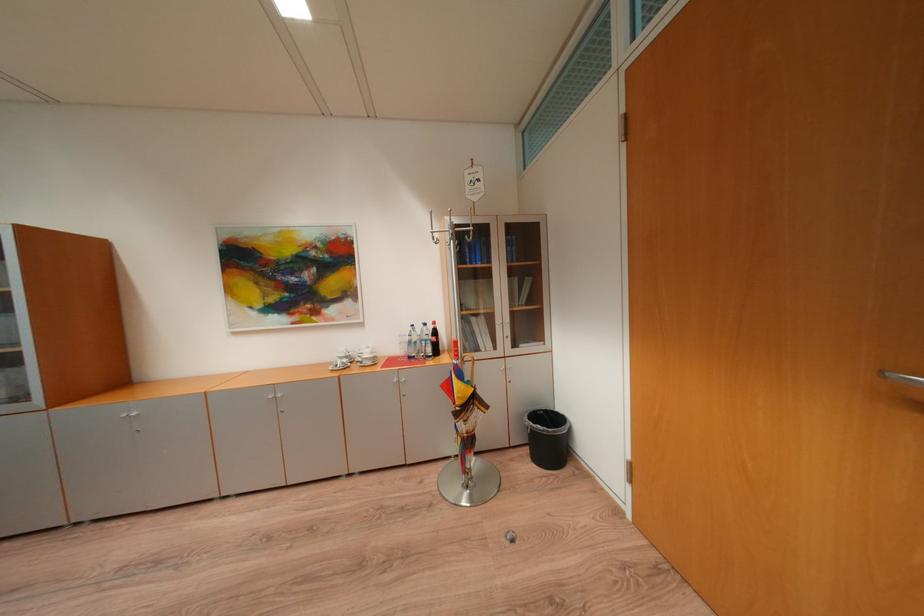
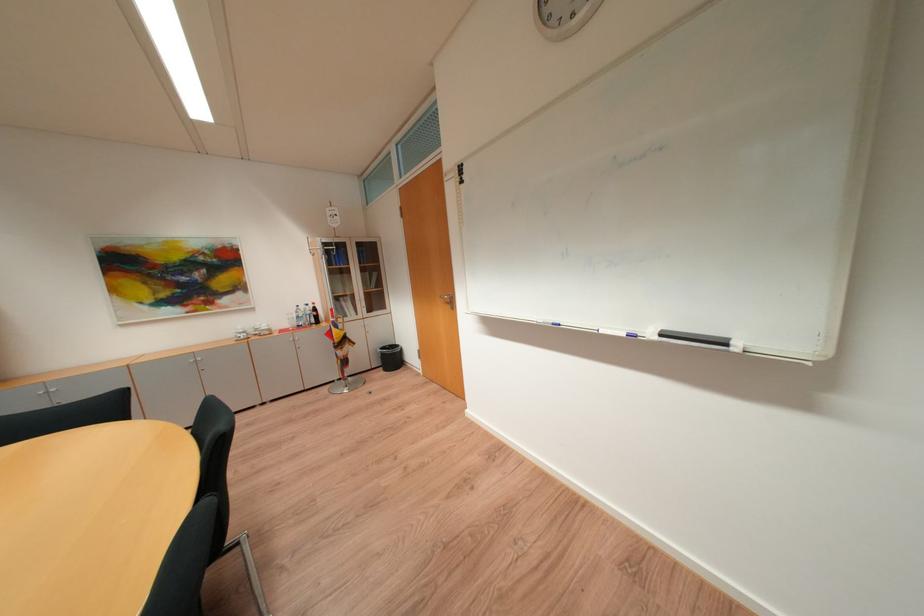
The point at (556, 440) is marked in the first image. Where is the corresponding point in the second image?

(400, 360)